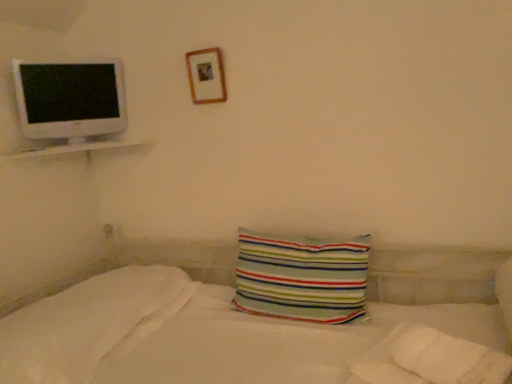
This screenshot has height=384, width=512. Identify the location of striped fabric pillow at center, which ranks as the second pillow in left-to-right order. (302, 277).

Measure the distance between point (143,145) and camera.

A distance of 2.14 meters exists between point (143,145) and camera.

Locate an element on the screen. The width and height of the screenshot is (512, 384). wooden picture frame at upper center is located at coordinates (206, 76).

Does wooden picture frame at upper center have a lesser width compared to striped fabric pillow at center, placed as the first pillow when sorted from right to left?

Yes.

Consider the image. Is wooden picture frame at upper center in front of striped fabric pillow at center, placed as the first pillow when sorted from right to left?

No, wooden picture frame at upper center is further to the viewer.

Is there a large distance between wooden picture frame at upper center and striped fabric pillow at center, placed as the first pillow when sorted from right to left?

wooden picture frame at upper center is near striped fabric pillow at center, placed as the first pillow when sorted from right to left, not far away.

Does wooden picture frame at upper center have a lesser height compared to striped fabric pillow at center, which ranks as the second pillow in left-to-right order?

Indeed, wooden picture frame at upper center has a lesser height compared to striped fabric pillow at center, which ranks as the second pillow in left-to-right order.

Is the surface of white soft pillow at lower left, which is the 1th pillow from left to right, in direct contact with white glossy shelf at upper left?

No, white soft pillow at lower left, which is the 1th pillow from left to right, is not with white glossy shelf at upper left.

Is white soft pillow at lower left, the 2th pillow viewed from the right, wider or thinner than white glossy shelf at upper left?

Considering their sizes, white soft pillow at lower left, the 2th pillow viewed from the right, looks broader than white glossy shelf at upper left.

Which of these two, white soft pillow at lower left, the 2th pillow viewed from the right, or white glossy shelf at upper left, stands shorter?

With less height is white glossy shelf at upper left.

Between white soft pillow at lower left, the 2th pillow viewed from the right, and white glossy shelf at upper left, which one has larger size?

white soft pillow at lower left, the 2th pillow viewed from the right.

This screenshot has width=512, height=384. In order to click on computer monitor above the white soft pillow at lower left, which is the 1th pillow from left to right (from a real-world perspective) in this screenshot , I will do `click(69, 99)`.

Can you confirm if white glossy computer monitor at upper left is wider than white soft pillow at lower left, which is the 1th pillow from left to right?

No.

Between white glossy computer monitor at upper left and white soft pillow at lower left, which is the 1th pillow from left to right, which one appears on the left side from the viewer's perspective?

white glossy computer monitor at upper left is more to the left.

Is white glossy computer monitor at upper left facing towards white soft pillow at lower left, the 2th pillow viewed from the right?

No.

Is white glossy shelf at upper left situated inside white glossy computer monitor at upper left or outside?

white glossy shelf at upper left is not inside white glossy computer monitor at upper left, it's outside.

Which point is more distant from viewer, (89,148) or (25,114)?

The point (89,148) is farther from the camera.

From the picture: Between white glossy shelf at upper left and white glossy computer monitor at upper left, which one has larger size?

With larger size is white glossy computer monitor at upper left.

Is white glossy shelf at upper left positioned far away from white glossy computer monitor at upper left?

white glossy shelf at upper left is actually quite close to white glossy computer monitor at upper left.

Is white glossy computer monitor at upper left positioned before striped fabric pillow at center, which ranks as the second pillow in left-to-right order?

No, white glossy computer monitor at upper left is further to the viewer.

From the image's perspective, would you say white glossy computer monitor at upper left is shown under striped fabric pillow at center, which ranks as the second pillow in left-to-right order?

No.

Considering the sizes of objects white glossy computer monitor at upper left and striped fabric pillow at center, which ranks as the second pillow in left-to-right order, in the image provided, who is smaller, white glossy computer monitor at upper left or striped fabric pillow at center, which ranks as the second pillow in left-to-right order,?

Smaller between the two is white glossy computer monitor at upper left.

Identify the location of computer monitor on the left of striped fabric pillow at center, placed as the first pillow when sorted from right to left. (69, 99).

Identify the location of computer monitor above the white soft pillow at lower left, the 2th pillow viewed from the right (from the image's perspective). The height and width of the screenshot is (384, 512). (69, 99).

Is white soft pillow at lower left, the 2th pillow viewed from the right, inside or outside of white glossy computer monitor at upper left?

white soft pillow at lower left, the 2th pillow viewed from the right, exists outside the volume of white glossy computer monitor at upper left.

From the image's perspective, relative to white glossy computer monitor at upper left, is white soft pillow at lower left, the 2th pillow viewed from the right, above or below?

Result: Clearly, from the image's perspective, white soft pillow at lower left, the 2th pillow viewed from the right, is below white glossy computer monitor at upper left.

Is white soft pillow at lower left, the 2th pillow viewed from the right, in contact with white glossy computer monitor at upper left?

No, white soft pillow at lower left, the 2th pillow viewed from the right, is not next to white glossy computer monitor at upper left.

Between striped fabric pillow at center, placed as the first pillow when sorted from right to left, and wooden picture frame at upper center, which one has more height?

With more height is striped fabric pillow at center, placed as the first pillow when sorted from right to left.

Between striped fabric pillow at center, placed as the first pillow when sorted from right to left, and wooden picture frame at upper center, which one has larger size?

Bigger between the two is striped fabric pillow at center, placed as the first pillow when sorted from right to left.

Are striped fabric pillow at center, which ranks as the second pillow in left-to-right order, and wooden picture frame at upper center far apart?

striped fabric pillow at center, which ranks as the second pillow in left-to-right order, is actually quite close to wooden picture frame at upper center.

Find the location of a particular element. This screenshot has width=512, height=384. pillow lying on the right of wooden picture frame at upper center is located at coordinates (302, 277).

Image resolution: width=512 pixels, height=384 pixels. I want to click on the 2nd pillow positioned below the white glossy shelf at upper left (from a real-world perspective), so click(89, 324).

From the image, which object appears to be nearer to white soft pillow at lower left, the 2th pillow viewed from the right, white glossy computer monitor at upper left or wooden picture frame at upper center?

Among the two, white glossy computer monitor at upper left is located nearer to white soft pillow at lower left, the 2th pillow viewed from the right.

From the image, which object appears to be nearer to white soft pillow at lower left, the 2th pillow viewed from the right, white glossy computer monitor at upper left or striped fabric pillow at center, which ranks as the second pillow in left-to-right order?

The object closer to white soft pillow at lower left, the 2th pillow viewed from the right, is striped fabric pillow at center, which ranks as the second pillow in left-to-right order.

Which object lies further to the anchor point wooden picture frame at upper center, white glossy computer monitor at upper left or white soft pillow at lower left, the 2th pillow viewed from the right?

white soft pillow at lower left, the 2th pillow viewed from the right.

Looking at the image, which one is located closer to wooden picture frame at upper center, striped fabric pillow at center, placed as the first pillow when sorted from right to left, or white glossy shelf at upper left?

Among the two, white glossy shelf at upper left is located nearer to wooden picture frame at upper center.

Considering their positions, is white glossy computer monitor at upper left positioned further to white glossy shelf at upper left than striped fabric pillow at center, which ranks as the second pillow in left-to-right order?

striped fabric pillow at center, which ranks as the second pillow in left-to-right order, is further to white glossy shelf at upper left.

Which object lies nearer to the anchor point striped fabric pillow at center, which ranks as the second pillow in left-to-right order, white glossy shelf at upper left or wooden picture frame at upper center?

wooden picture frame at upper center is positioned closer to the anchor striped fabric pillow at center, which ranks as the second pillow in left-to-right order.

Based on their spatial positions, is wooden picture frame at upper center or striped fabric pillow at center, which ranks as the second pillow in left-to-right order, closer to white glossy computer monitor at upper left?

Based on the image, wooden picture frame at upper center appears to be nearer to white glossy computer monitor at upper left.

Based on their spatial positions, is white soft pillow at lower left, the 2th pillow viewed from the right, or striped fabric pillow at center, which ranks as the second pillow in left-to-right order, closer to white glossy computer monitor at upper left?

The object closer to white glossy computer monitor at upper left is white soft pillow at lower left, the 2th pillow viewed from the right.

You are a GUI agent. You are given a task and a screenshot of the screen. Output one action in this format:
    pyautogui.click(x=<x>, y=<y>)
    Task: Click on the ledge that lies between white glossy computer monitor at upper left and white soft pillow at lower left, the 2th pillow viewed from the right, from top to bottom
    The image size is (512, 384).
    Given the screenshot: What is the action you would take?
    pyautogui.click(x=76, y=148)

Where is `pillow between wooden picture frame at upper center and white soft pillow at lower left, the 2th pillow viewed from the right, vertically`? The width and height of the screenshot is (512, 384). pillow between wooden picture frame at upper center and white soft pillow at lower left, the 2th pillow viewed from the right, vertically is located at coordinates (302, 277).

Where is `picture frame between white glossy shelf at upper left and striped fabric pillow at center, placed as the first pillow when sorted from right to left, from left to right`? The image size is (512, 384). picture frame between white glossy shelf at upper left and striped fabric pillow at center, placed as the first pillow when sorted from right to left, from left to right is located at coordinates (206, 76).

Where is `ledge between white glossy computer monitor at upper left and wooden picture frame at upper center`? This screenshot has width=512, height=384. ledge between white glossy computer monitor at upper left and wooden picture frame at upper center is located at coordinates (76, 148).